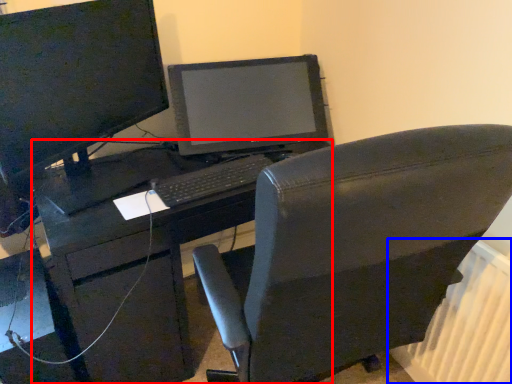
Question: Which object is closer to the camera taking this photo, desk (highlighted by a red box) or radiator (highlighted by a blue box)?

Choices:
 (A) desk
 (B) radiator

Answer: (B)